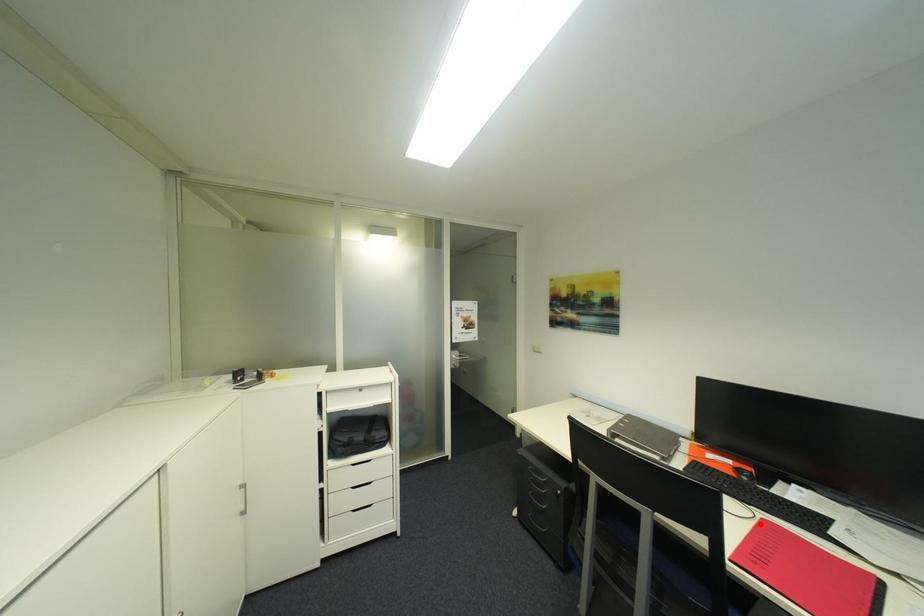
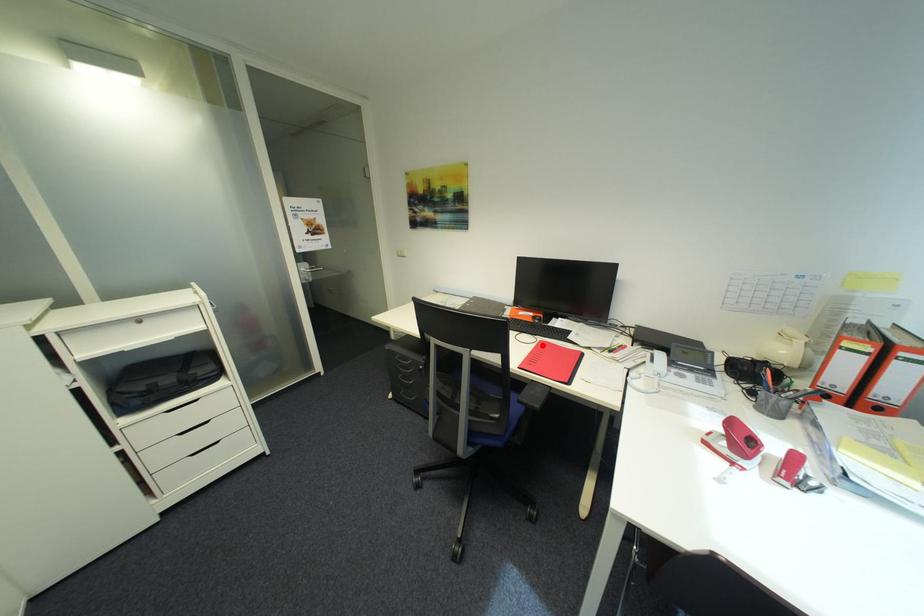
I am providing you with two images of the same scene from different viewpoints. A red point is marked on the first image and another point is marked on the second image. Do the highlighted points in image1 and image2 indicate the same real-world spot?

Yes